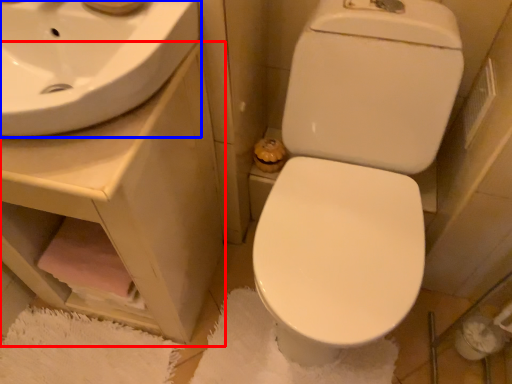
Question: Among these objects, which one is farthest to the camera, counter top (highlighted by a red box) or sink (highlighted by a blue box)?

Choices:
 (A) counter top
 (B) sink

Answer: (A)